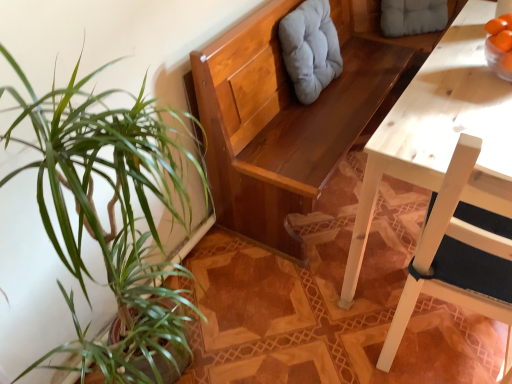
Question: Can you confirm if gray fabric cushion at upper center, the 2th swivel chair positioned from the left, is positioned to the right of light gray fabric cushion at upper center, the 1th swivel chair in the left-to-right sequence?

Choices:
 (A) no
 (B) yes

Answer: (B)

Question: Is gray fabric cushion at upper center, the 2th swivel chair positioned from the left, surrounding light gray fabric cushion at upper center, marked as the 2th swivel chair in a right-to-left arrangement?

Choices:
 (A) yes
 (B) no

Answer: (B)

Question: Can you confirm if gray fabric cushion at upper center, which ranks as the second swivel chair in front-to-back order, is taller than light gray fabric cushion at upper center, the second swivel chair from the back?

Choices:
 (A) no
 (B) yes

Answer: (A)

Question: Is gray fabric cushion at upper center, which appears as the first swivel chair when viewed from the back, in front of light gray fabric cushion at upper center, marked as the 2th swivel chair in a right-to-left arrangement?

Choices:
 (A) no
 (B) yes

Answer: (A)

Question: Is gray fabric cushion at upper center, which appears as the first swivel chair when viewed from the back, outside of light gray fabric cushion at upper center, the second swivel chair from the back?

Choices:
 (A) yes
 (B) no

Answer: (A)

Question: Is gray fabric cushion at upper center, which ranks as the second swivel chair in front-to-back order, oriented towards light gray fabric cushion at upper center, the second swivel chair from the back?

Choices:
 (A) no
 (B) yes

Answer: (A)

Question: Considering the relative sizes of white wood chair at right and gray fabric cushion at upper center, which appears as the first swivel chair when viewed from the back, in the image provided, is white wood chair at right smaller than gray fabric cushion at upper center, which appears as the first swivel chair when viewed from the back,?

Choices:
 (A) yes
 (B) no

Answer: (B)

Question: Considering the relative sizes of white wood chair at right and gray fabric cushion at upper center, acting as the first swivel chair starting from the right, in the image provided, is white wood chair at right taller than gray fabric cushion at upper center, acting as the first swivel chair starting from the right,?

Choices:
 (A) yes
 (B) no

Answer: (A)

Question: Can you confirm if white wood chair at right is positioned to the right of gray fabric cushion at upper center, which ranks as the second swivel chair in front-to-back order?

Choices:
 (A) yes
 (B) no

Answer: (B)

Question: Is white wood chair at right not close to gray fabric cushion at upper center, acting as the first swivel chair starting from the right?

Choices:
 (A) yes
 (B) no

Answer: (A)

Question: Is white wood chair at right facing towards gray fabric cushion at upper center, acting as the first swivel chair starting from the right?

Choices:
 (A) yes
 (B) no

Answer: (B)

Question: Is white wood chair at right further to the viewer compared to gray fabric cushion at upper center, which appears as the first swivel chair when viewed from the back?

Choices:
 (A) no
 (B) yes

Answer: (A)

Question: Is light gray fabric cushion at upper center, the 1th swivel chair in the left-to-right sequence, to the left of gray fabric cushion at upper center, which ranks as the second swivel chair in front-to-back order, from the viewer's perspective?

Choices:
 (A) yes
 (B) no

Answer: (A)